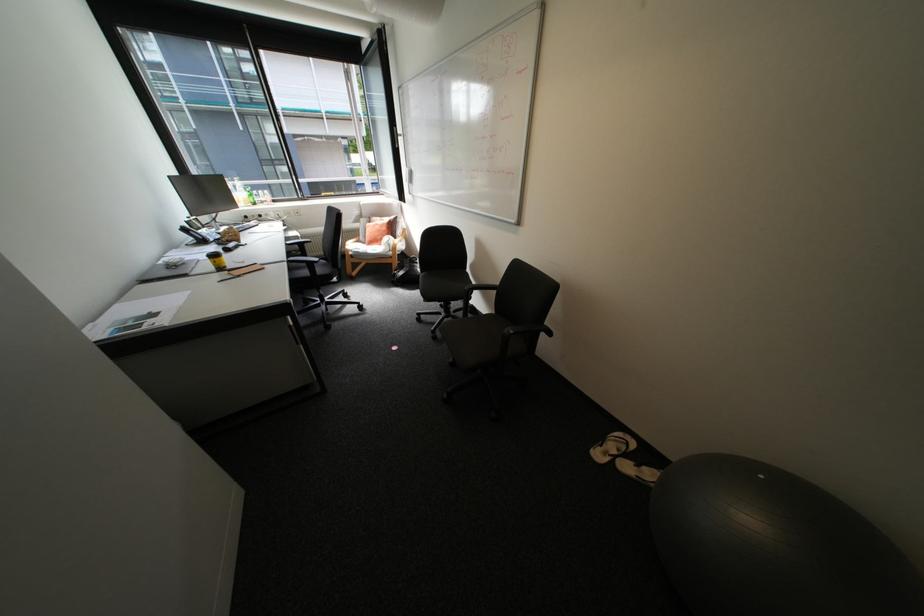
Find the location of a particular element. The image size is (924, 616). gray exercise ball is located at coordinates (767, 533).